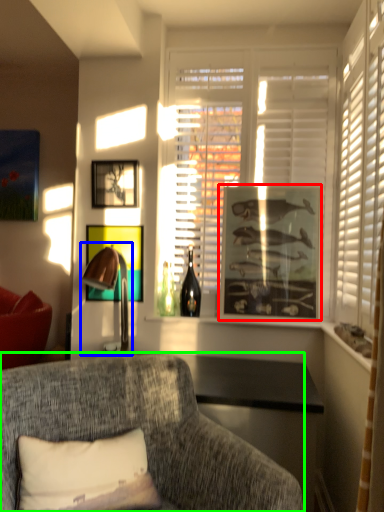
Question: Based on their relative distances, which object is farther from picture frame (highlighted by a red box)? Choose from table lamp (highlighted by a blue box) and studio couch (highlighted by a green box).

Choices:
 (A) table lamp
 (B) studio couch

Answer: (B)